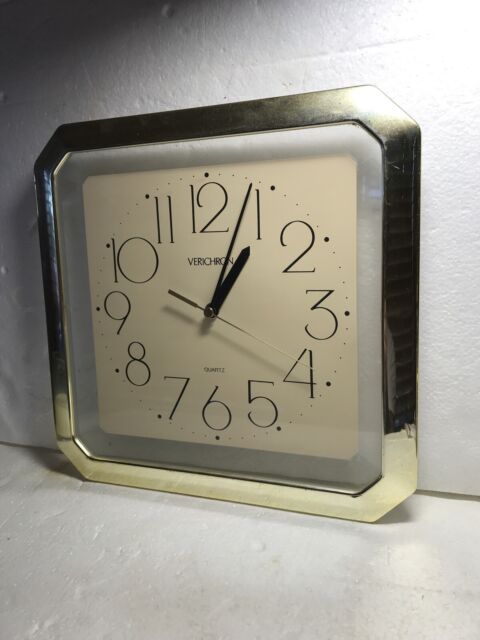
In order to click on beveled corner in this screenshot , I will do `click(394, 500)`.